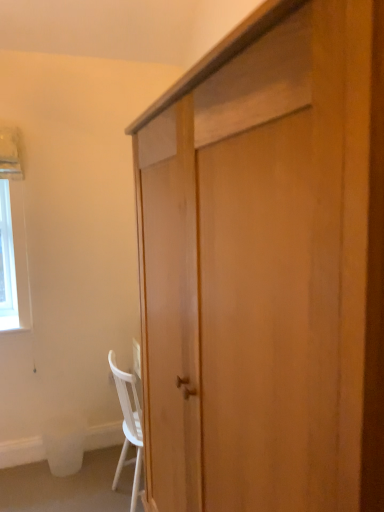
Question: Is white plastic trash bin at lower left taller or shorter than light wood cabinet at center?

Choices:
 (A) tall
 (B) short

Answer: (B)

Question: Considering their positions, is white plastic trash bin at lower left located in front of or behind light wood cabinet at center?

Choices:
 (A) behind
 (B) front

Answer: (A)

Question: Based on their relative distances, which object is nearer to the light wood cabinet at center?

Choices:
 (A) white plastic trash bin at lower left
 (B) white matte chair at lower left

Answer: (B)

Question: Which object is positioned closest to the white plastic trash bin at lower left?

Choices:
 (A) light wood cabinet at center
 (B) white matte chair at lower left

Answer: (B)